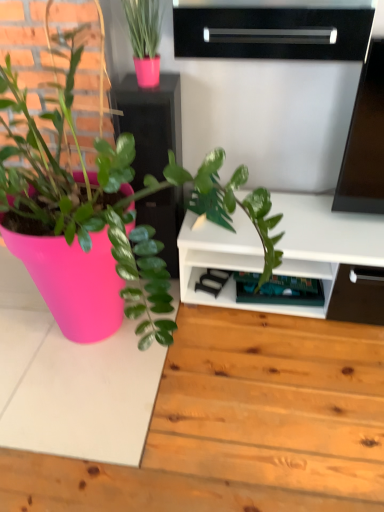
Question: Is matte black cabinet at upper center at the right side of black glossy shelf at upper center, placed as the 1th shelf when sorted from top to bottom?

Choices:
 (A) no
 (B) yes

Answer: (A)

Question: Is matte black cabinet at upper center surrounding black glossy shelf at upper center, which is the 2th shelf from back to front?

Choices:
 (A) yes
 (B) no

Answer: (B)

Question: Considering the relative positions of matte black cabinet at upper center and black glossy shelf at upper center, placed as the second shelf when sorted from bottom to top, in the image provided, is matte black cabinet at upper center to the left of black glossy shelf at upper center, placed as the second shelf when sorted from bottom to top, from the viewer's perspective?

Choices:
 (A) no
 (B) yes

Answer: (B)

Question: Can you confirm if matte black cabinet at upper center is bigger than black glossy shelf at upper center, placed as the 1th shelf when sorted from top to bottom?

Choices:
 (A) yes
 (B) no

Answer: (A)

Question: Is matte black cabinet at upper center beside black glossy shelf at upper center, placed as the 1th shelf when sorted from top to bottom?

Choices:
 (A) yes
 (B) no

Answer: (B)

Question: From the image's perspective, relative to green plastic shelf at lower center, positioned as the 1th shelf in bottom-to-top order, is black glossy shelf at upper center, which ranks as the first shelf in front-to-back order, above or below?

Choices:
 (A) below
 (B) above

Answer: (B)

Question: From a real-world perspective, is black glossy shelf at upper center, which ranks as the first shelf in front-to-back order, positioned above or below green plastic shelf at lower center, the first shelf when ordered from back to front?

Choices:
 (A) above
 (B) below

Answer: (A)

Question: Considering the relative positions of black glossy shelf at upper center, placed as the second shelf when sorted from bottom to top, and green plastic shelf at lower center, the 2th shelf from the top, in the image provided, is black glossy shelf at upper center, placed as the second shelf when sorted from bottom to top, to the left or to the right of green plastic shelf at lower center, the 2th shelf from the top,?

Choices:
 (A) left
 (B) right

Answer: (A)

Question: Considering the positions of black glossy shelf at upper center, placed as the 1th shelf when sorted from top to bottom, and green plastic shelf at lower center, the first shelf when ordered from back to front, in the image, is black glossy shelf at upper center, placed as the 1th shelf when sorted from top to bottom, bigger or smaller than green plastic shelf at lower center, the first shelf when ordered from back to front,?

Choices:
 (A) small
 (B) big

Answer: (B)

Question: Visually, is matte black cabinet at upper center positioned to the left or to the right of green plastic shelf at lower center, the first shelf when ordered from back to front?

Choices:
 (A) left
 (B) right

Answer: (A)

Question: Considering the positions of point (134, 136) and point (238, 298), is point (134, 136) closer or farther from the camera than point (238, 298)?

Choices:
 (A) closer
 (B) farther

Answer: (A)

Question: In the image, is matte black cabinet at upper center positioned in front of or behind green plastic shelf at lower center, positioned as the 1th shelf in bottom-to-top order?

Choices:
 (A) front
 (B) behind

Answer: (A)

Question: Is matte black cabinet at upper center spatially inside green plastic shelf at lower center, the first shelf when ordered from back to front, or outside of it?

Choices:
 (A) outside
 (B) inside

Answer: (A)

Question: In the image, is black glossy shelf at upper center, placed as the second shelf when sorted from bottom to top, positioned in front of or behind matte black cabinet at upper center?

Choices:
 (A) front
 (B) behind

Answer: (A)

Question: From a real-world perspective, relative to matte black cabinet at upper center, is black glossy shelf at upper center, which ranks as the first shelf in front-to-back order, vertically above or below?

Choices:
 (A) below
 (B) above

Answer: (B)